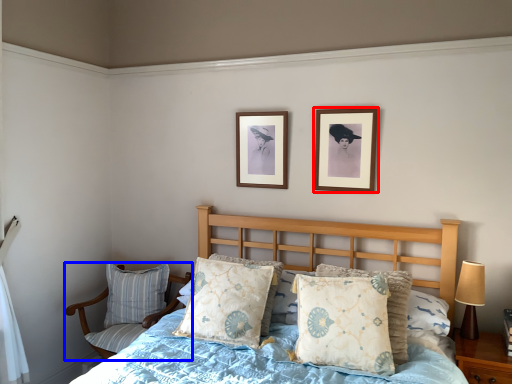
Question: Which object is further to the camera taking this photo, picture frame (highlighted by a red box) or chair (highlighted by a blue box)?

Choices:
 (A) picture frame
 (B) chair

Answer: (B)